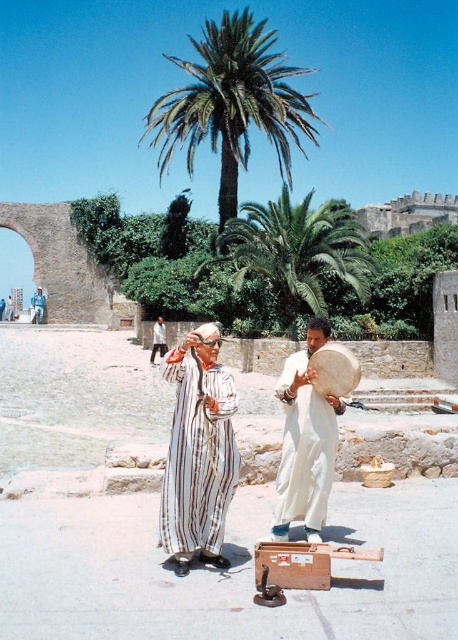
Is point (213, 337) positioned before point (349, 211)?

Yes, point (213, 337) is closer to viewer.

What are the coordinates of `striped fabric man at center` in the screenshot? It's located at (198, 452).

Is point (229, 150) in front of point (274, 394)?

No, (229, 150) is behind (274, 394).

Can you confirm if green leafy palm tree at upper center is positioned above white matte drum at center?

Yes, green leafy palm tree at upper center is above white matte drum at center.

Which is in front, point (214, 145) or point (271, 531)?

Point (271, 531) is more forward.

Image resolution: width=458 pixels, height=640 pixels. Find the location of `green leafy palm tree at upper center`. green leafy palm tree at upper center is located at coordinates (232, 104).

In the scene shown: Does striped cotton robe at center appear on the right side of white matte drum at center?

In fact, striped cotton robe at center is to the left of white matte drum at center.

Can you confirm if striped cotton robe at center is shorter than white matte drum at center?

Indeed, striped cotton robe at center has a lesser height compared to white matte drum at center.

From the picture: Who is more distant from viewer, (181, 490) or (316, 509)?

The point (316, 509) is behind.

Find the location of `striped cotton robe at center`. striped cotton robe at center is located at coordinates (197, 458).